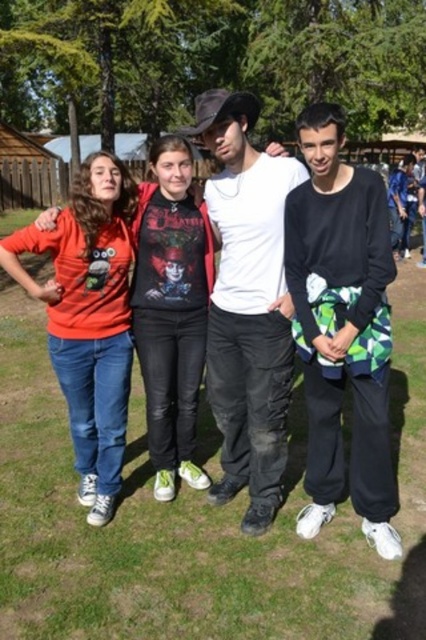
Can you confirm if white matte shirt at center is bigger than matte red hoodie at center?

Yes, white matte shirt at center is bigger than matte red hoodie at center.

Can you confirm if white matte shirt at center is positioned above matte red hoodie at center?

Indeed, white matte shirt at center is positioned over matte red hoodie at center.

Does point (216, 353) come in front of point (178, 264)?

No.

The image size is (426, 640). Find the location of `white matte shirt at center`. white matte shirt at center is located at coordinates [247, 305].

Can you confirm if matte red t-shirt at left is positioned to the right of matte red hoodie at center?

Incorrect, matte red t-shirt at left is not on the right side of matte red hoodie at center.

Can you confirm if matte red t-shirt at left is thinner than matte red hoodie at center?

No.

In order to click on matte red t-shirt at left in this screenshot , I will do `click(89, 320)`.

Does green grass at lower center have a greater width compared to black matte pants at right?

Indeed, green grass at lower center has a greater width compared to black matte pants at right.

Locate an element on the screen. The height and width of the screenshot is (640, 426). green grass at lower center is located at coordinates (192, 529).